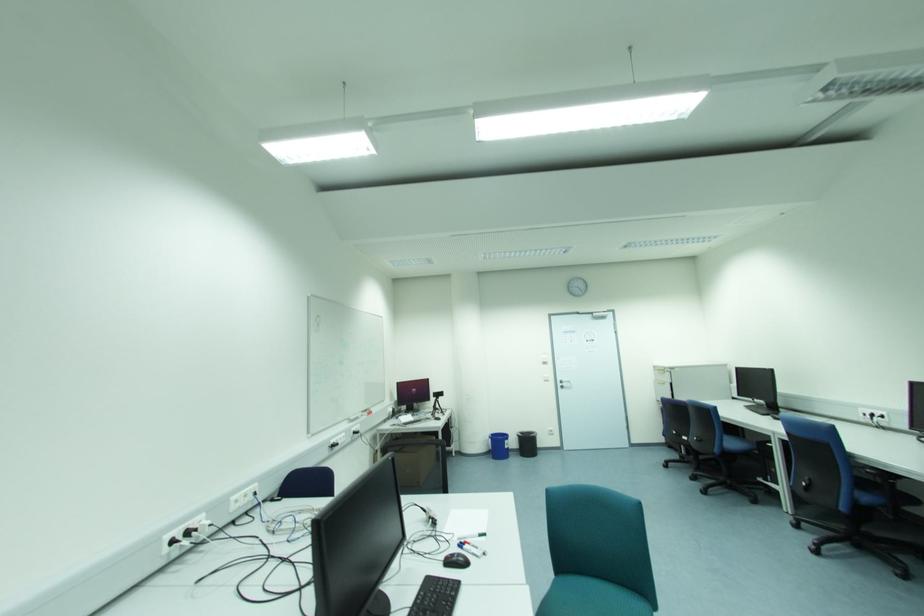
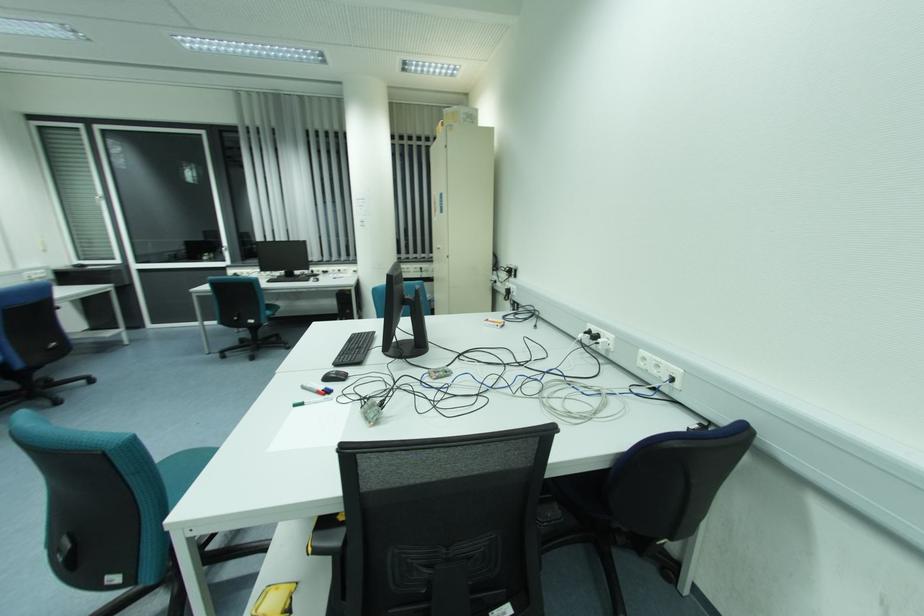
The point at (200, 522) is marked in the first image. Where is the corresponding point in the second image?

(608, 339)